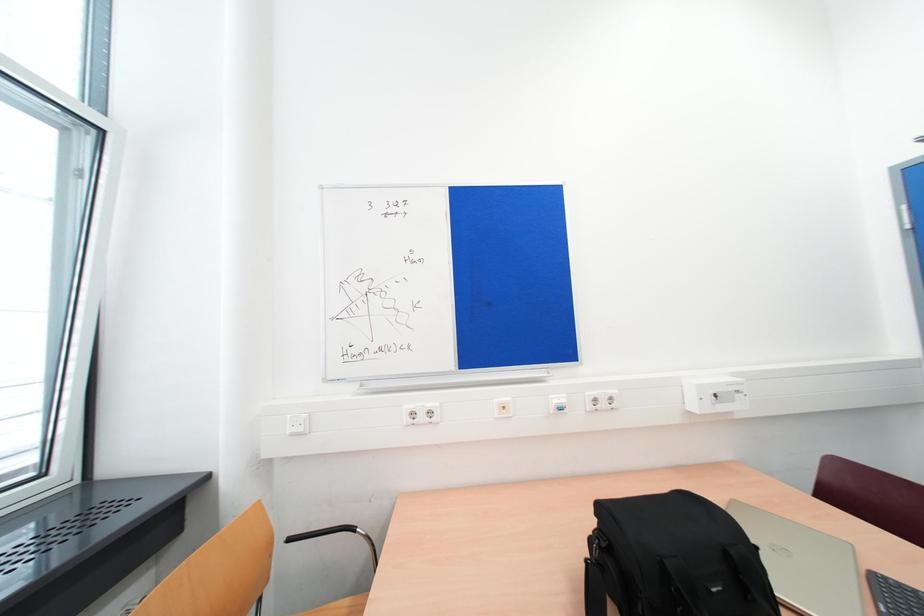
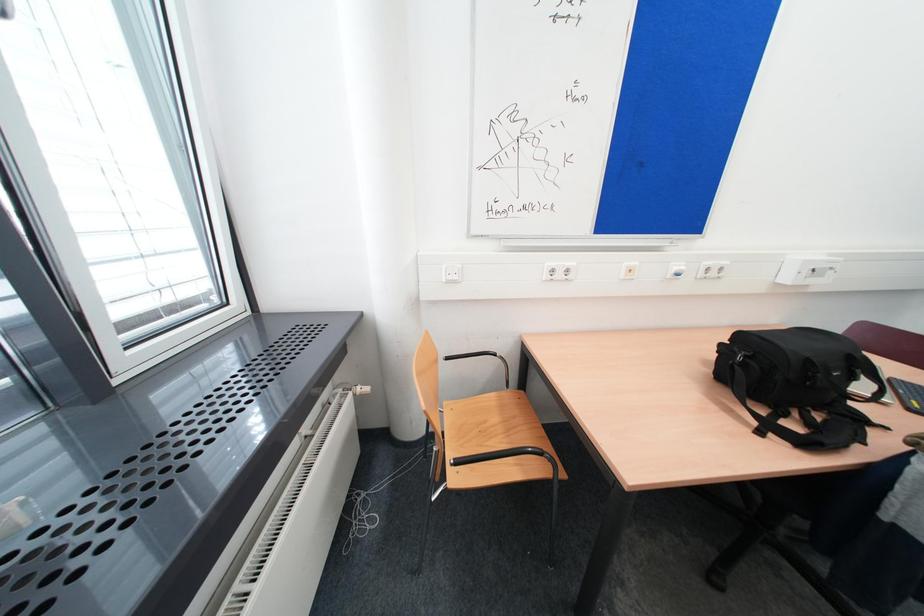
Question: Which direction would the cameraman need to move to produce the second image? Reply with the corresponding letter.

Choices:
 (A) Left
 (B) Right
 (C) Forward
 (D) Backward

Answer: (A)